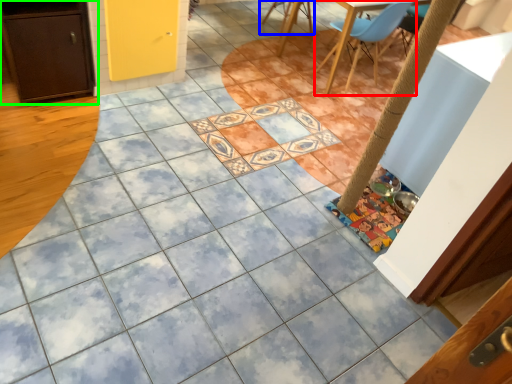
Question: Estimate the real-world distances between objects in this image. Which object is closer to chair (highlighted by a red box), chair (highlighted by a blue box) or cabinetry (highlighted by a green box)?

Choices:
 (A) chair
 (B) cabinetry

Answer: (A)